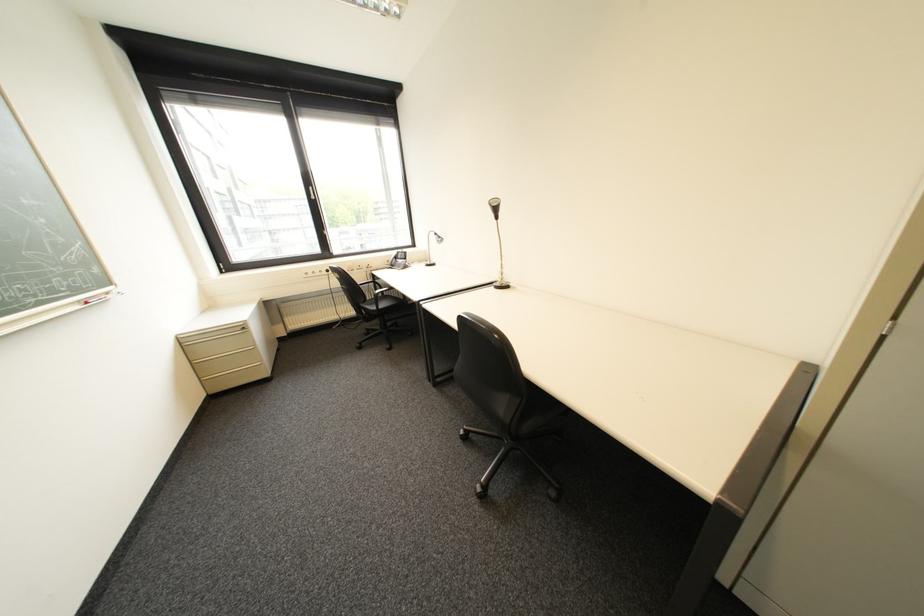
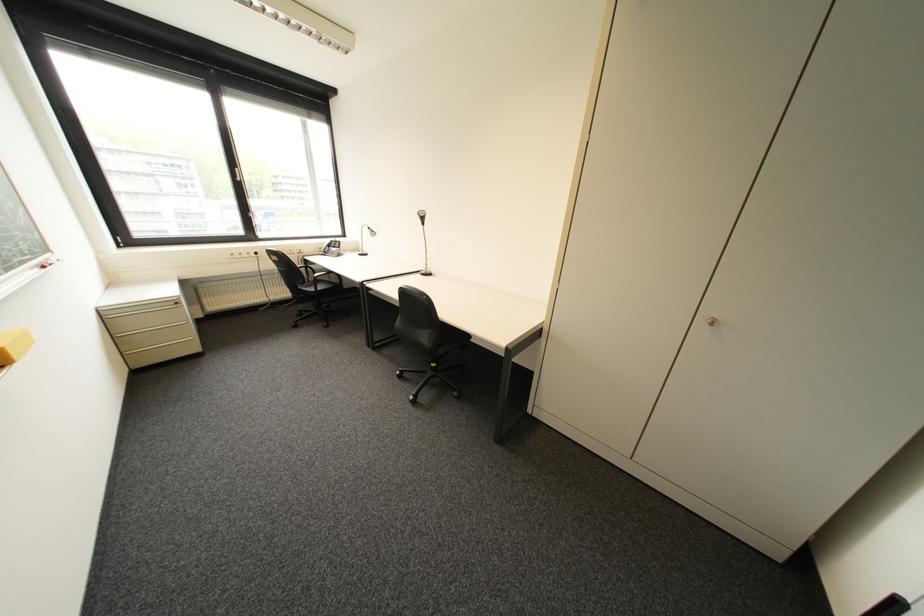
Find the pixel in the second image that matches point 201,362 in the first image.

(122, 336)